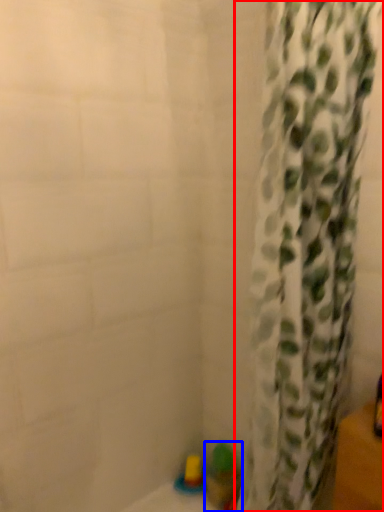
Question: Which of the following is the closest to the observer, curtain (highlighted by a red box) or toy (highlighted by a blue box)?

Choices:
 (A) curtain
 (B) toy

Answer: (A)